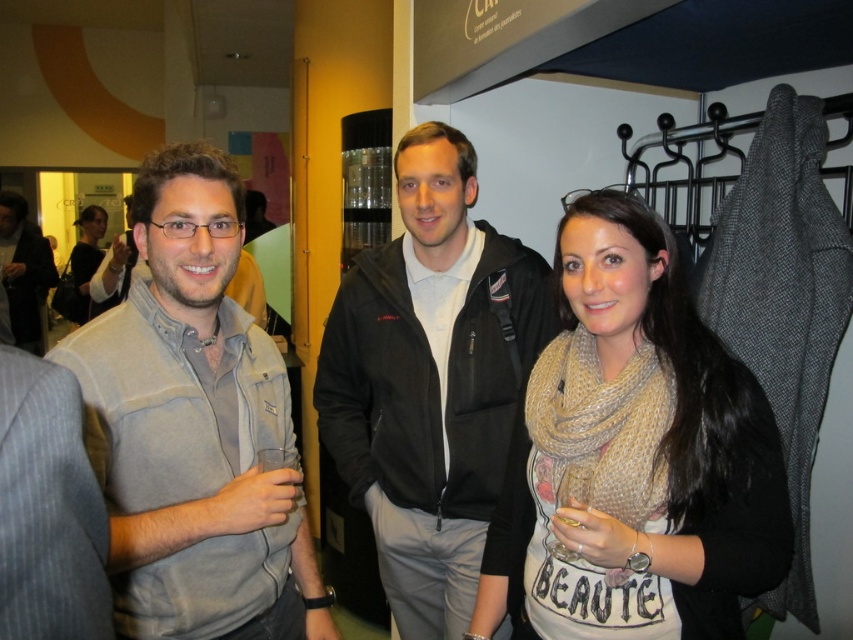
Question: Which object is closer to the camera taking this photo?

Choices:
 (A) knitted beige scarf at center
 (B) black fleece jacket at center

Answer: (A)

Question: Which point appears farthest from the camera in this image?

Choices:
 (A) (457, 326)
 (B) (531, 618)

Answer: (A)

Question: Is black fleece jacket at center to the right of gray fleece jacket at left from the viewer's perspective?

Choices:
 (A) no
 (B) yes

Answer: (B)

Question: Which object appears farthest from the camera in this image?

Choices:
 (A) gray fleece jacket at left
 (B) black fleece jacket at center

Answer: (A)

Question: Does gray fleece vest at left have a lesser width compared to gray fleece jacket at left?

Choices:
 (A) no
 (B) yes

Answer: (B)

Question: Can you confirm if knitted beige scarf at center is smaller than black fleece jacket at center?

Choices:
 (A) no
 (B) yes

Answer: (B)